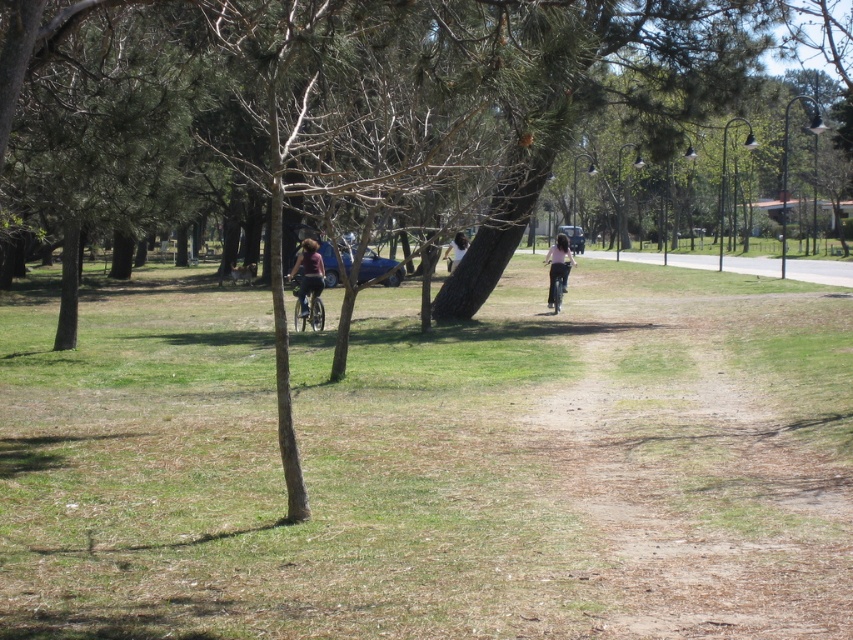
You are standing in the park and see the green grass at center and the pink fabric pants at center. Which object is located to the left when viewed from your perspective?

The green grass at center is to the left of the pink fabric pants at center.

You are a photographer setting up a shot of the park scene. You want to ensure the green grass at center and the pink fabric pants at center are both visible in your frame. Which object should you focus on to ensure both are in focus?

The green grass at center is wider than the pink fabric pants at center, so focusing on the green grass at center will ensure both are in focus.